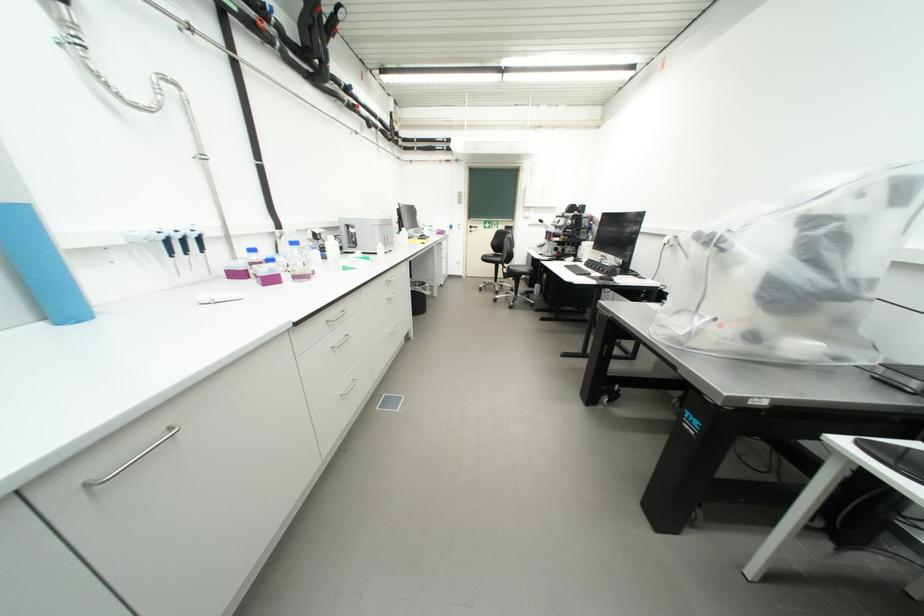
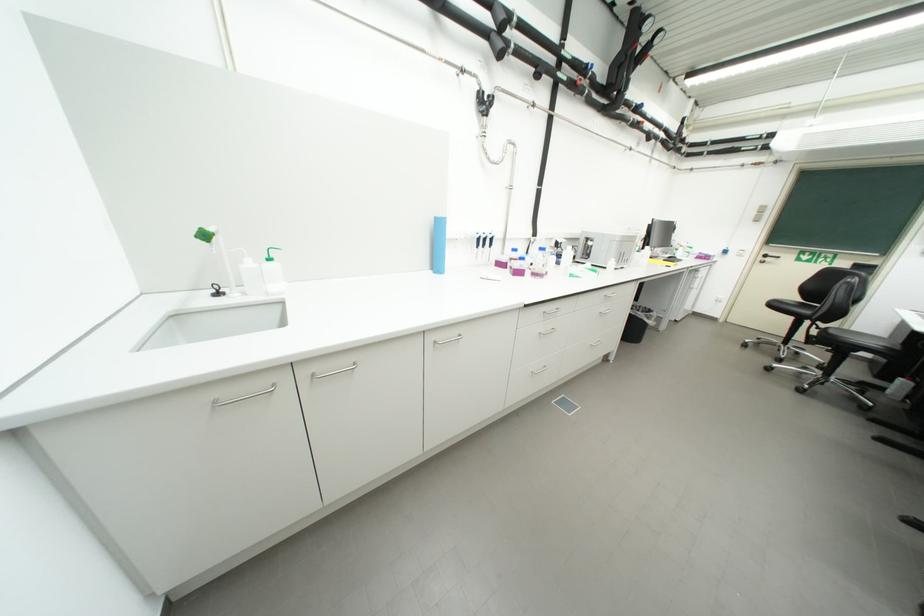
The point at (51,326) is marked in the first image. Where is the corresponding point in the second image?

(439, 273)